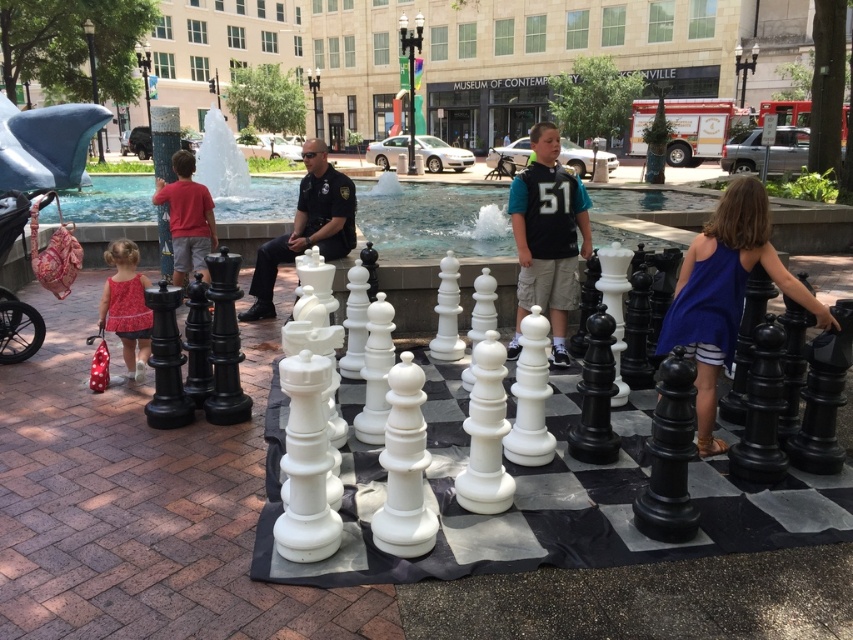
Who is taller, matte black uniform at center or matte red dress at left?

matte black uniform at center is taller.

Does matte black uniform at center have a greater height compared to matte red dress at left?

Yes.

The width and height of the screenshot is (853, 640). What do you see at coordinates (306, 227) in the screenshot?
I see `matte black uniform at center` at bounding box center [306, 227].

What are the coordinates of `matte black uniform at center` in the screenshot? It's located at (306, 227).

Is blue fabric dress at right wider than matte red dress at left?

Indeed, blue fabric dress at right has a greater width compared to matte red dress at left.

At what (x,y) coordinates should I click in order to perform the action: click on blue fabric dress at right. Please return your answer as a coordinate pair (x, y). Looking at the image, I should click on (724, 292).

Between blue fabric dress at right and matte black uniform at center, which one appears on the right side from the viewer's perspective?

blue fabric dress at right is more to the right.

What do you see at coordinates (724, 292) in the screenshot? I see `blue fabric dress at right` at bounding box center [724, 292].

At what (x,y) coordinates should I click in order to perform the action: click on blue fabric dress at right. Please return your answer as a coordinate pair (x, y). Looking at the image, I should click on (724, 292).